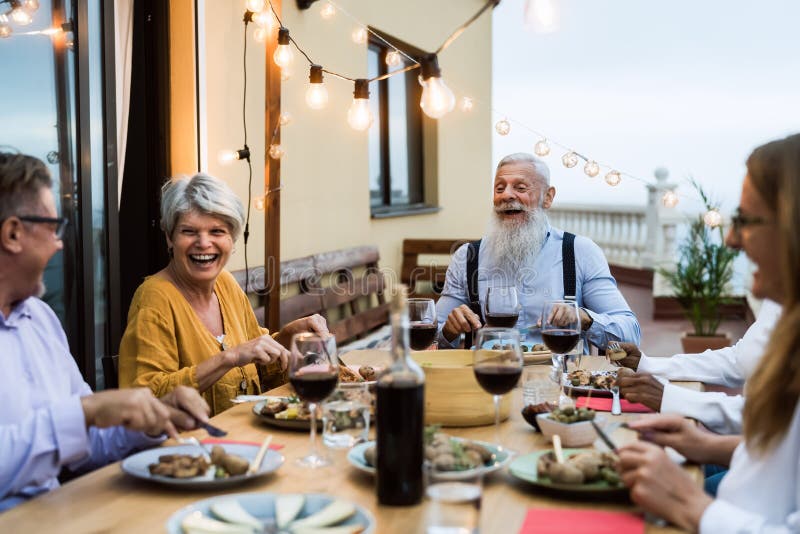
At what (x,y) coordinates should I click in order to perform the action: click on wine glass. Please return your answer as a coordinate pair (x, y). The image size is (800, 534). Looking at the image, I should click on (317, 370), (498, 357), (430, 326), (505, 309), (573, 327).